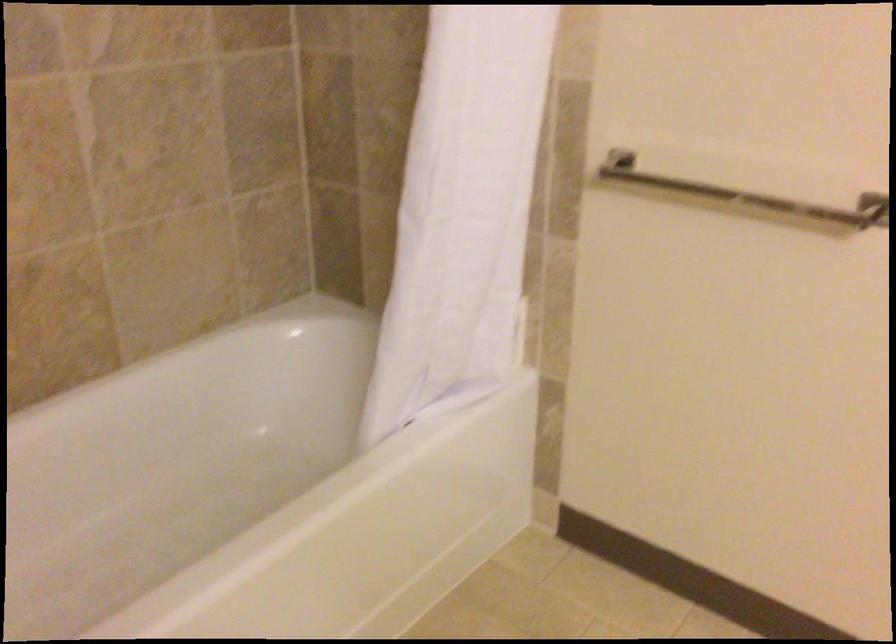
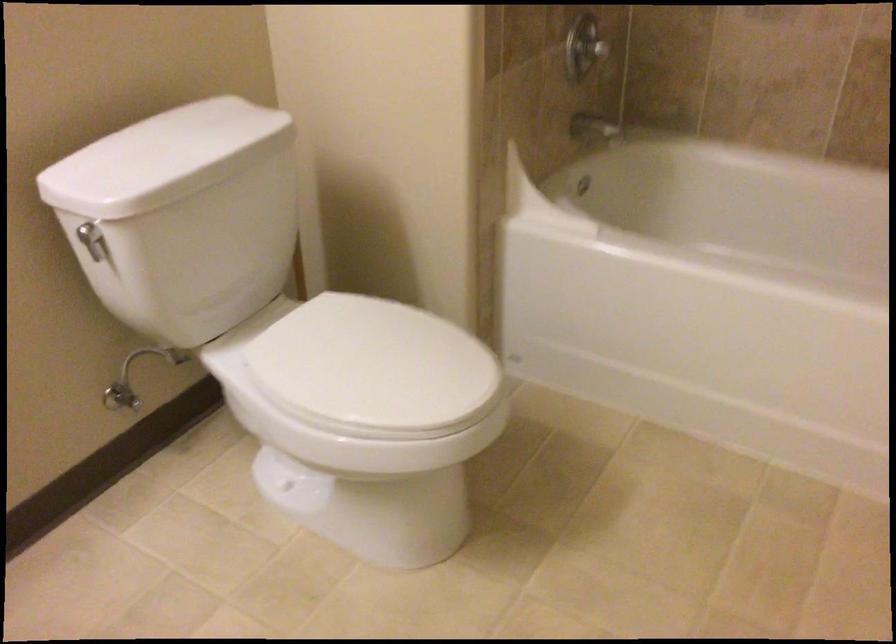
The images are taken continuously from a first-person perspective. In which direction is your viewpoint rotating?

The rotation direction of the camera is left-down.